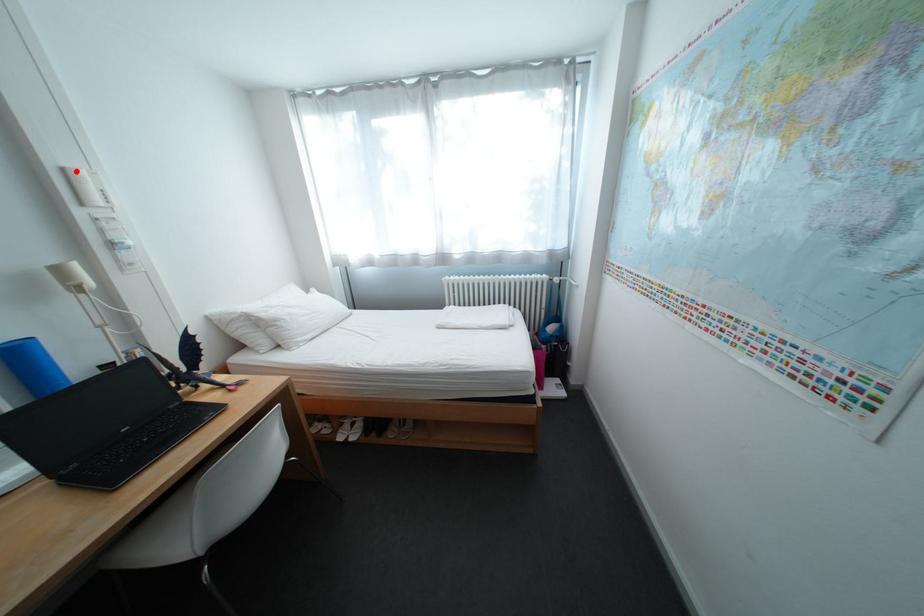
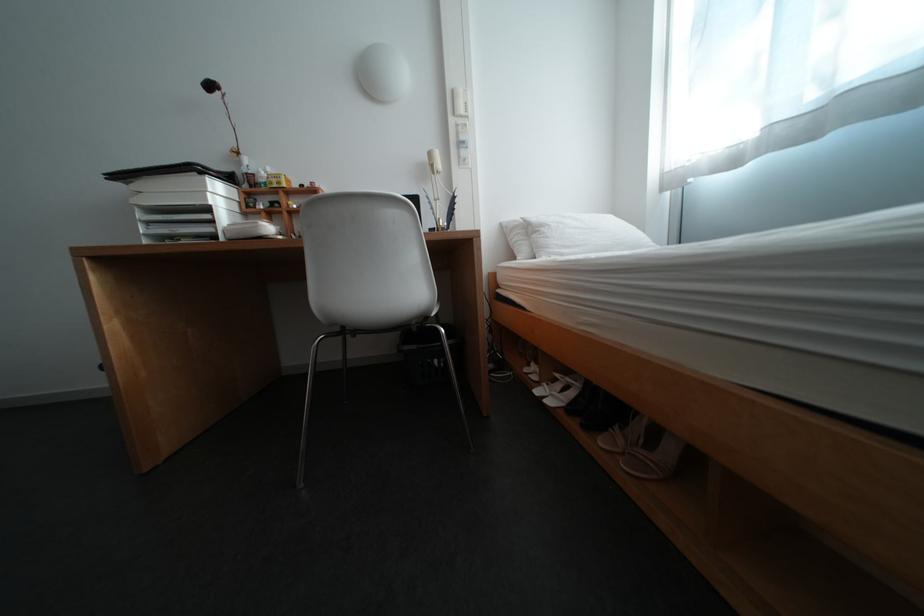
Question: I am providing you with two images of the same scene from different viewpoints. Given a red point in image1, look at the same physical point in image2. Is it:

Choices:
 (A) Closer to the viewpoint
 (B) Farther from the viewpoint

Answer: (A)